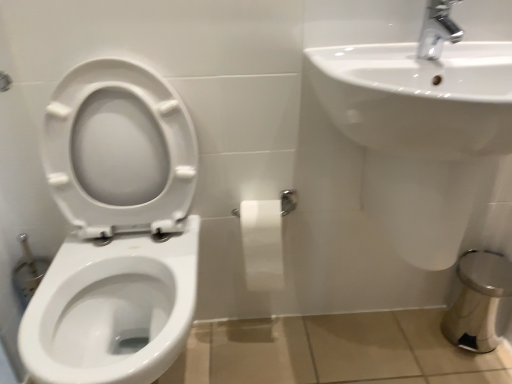
What do you see at coordinates (116, 229) in the screenshot? This screenshot has height=384, width=512. I see `white glossy toilet at left` at bounding box center [116, 229].

I want to click on white matte toilet paper at center, so click(x=262, y=244).

Is white glossy sink at upper right oriented towards chrome metallic faucet at upper right?

No, white glossy sink at upper right is not turned towards chrome metallic faucet at upper right.

Considering the relative sizes of white glossy sink at upper right and chrome metallic faucet at upper right in the image provided, is white glossy sink at upper right wider than chrome metallic faucet at upper right?

Yes, white glossy sink at upper right is wider than chrome metallic faucet at upper right.

Between white glossy sink at upper right and chrome metallic faucet at upper right, which one appears on the left side from the viewer's perspective?

white glossy sink at upper right.

Is white glossy sink at upper right not inside chrome metallic faucet at upper right?

white glossy sink at upper right lies outside chrome metallic faucet at upper right's area.

From the image's perspective, who appears lower, chrome metallic faucet at upper right or white matte toilet paper at center?

white matte toilet paper at center, from the image's perspective.

Which object is closer to the camera, chrome metallic faucet at upper right or white matte toilet paper at center?

chrome metallic faucet at upper right is more forward.

Can you confirm if chrome metallic faucet at upper right is smaller than white matte toilet paper at center?

Correct, chrome metallic faucet at upper right occupies less space than white matte toilet paper at center.

Are white matte toilet paper at center and white glossy toilet at left making contact?

No, white matte toilet paper at center is not in contact with white glossy toilet at left.

Image resolution: width=512 pixels, height=384 pixels. There is a white matte toilet paper at center. Identify the location of toilet above it (from a real-world perspective). (116, 229).

How distant is white matte toilet paper at center from white glossy toilet at left?

white matte toilet paper at center is 12.88 inches away from white glossy toilet at left.

Is white matte toilet paper at center bigger or smaller than white glossy toilet at left?

Clearly, white matte toilet paper at center is smaller in size than white glossy toilet at left.

Between chrome metallic faucet at upper right and white glossy toilet at left, which one appears on the right side from the viewer's perspective?

Positioned to the right is chrome metallic faucet at upper right.

Is chrome metallic faucet at upper right placed right next to white glossy toilet at left?

No.

This screenshot has height=384, width=512. What are the coordinates of `toilet below the chrome metallic faucet at upper right (from the image's perspective)` in the screenshot? It's located at (116, 229).

From the picture: Between white glossy toilet at left and white glossy sink at upper right, which one is positioned behind?

Positioned behind is white glossy sink at upper right.

Is point (150, 150) positioned in front of point (455, 131)?

No, (150, 150) is behind (455, 131).

Based on their positions, is white glossy toilet at left located to the left or right of white glossy sink at upper right?

In the image, white glossy toilet at left appears on the left side of white glossy sink at upper right.

Is white glossy toilet at left oriented towards white glossy sink at upper right?

No, white glossy toilet at left is not aimed at white glossy sink at upper right.

Which object is positioned more to the left, chrome metallic faucet at upper right or white glossy sink at upper right?

Positioned to the left is white glossy sink at upper right.

Is chrome metallic faucet at upper right oriented towards white glossy sink at upper right?

No, chrome metallic faucet at upper right is not turned towards white glossy sink at upper right.

Between chrome metallic faucet at upper right and white glossy sink at upper right, which one has less height?

Standing shorter between the two is chrome metallic faucet at upper right.

Would you consider chrome metallic faucet at upper right to be distant from white glossy sink at upper right?

No, chrome metallic faucet at upper right is not far away from white glossy sink at upper right.

Does white glossy sink at upper right appear on the right side of white matte toilet paper at center?

Indeed, white glossy sink at upper right is positioned on the right side of white matte toilet paper at center.

Looking at this image, considering the relative sizes of white glossy sink at upper right and white matte toilet paper at center in the image provided, is white glossy sink at upper right shorter than white matte toilet paper at center?

No, white glossy sink at upper right is not shorter than white matte toilet paper at center.

From a real-world perspective, relative to white matte toilet paper at center, is white glossy sink at upper right vertically above or below?

white glossy sink at upper right is situated higher than white matte toilet paper at center in the real world.

Image resolution: width=512 pixels, height=384 pixels. Find the location of `sink to the left of chrome metallic faucet at upper right`. sink to the left of chrome metallic faucet at upper right is located at coordinates (419, 133).

Locate an element on the screen. The image size is (512, 384). tap lying in front of the white matte toilet paper at center is located at coordinates (437, 29).

In the scene shown: When comparing their distances from white glossy toilet at left, does chrome metallic faucet at upper right or white matte toilet paper at center seem further?

The object further to white glossy toilet at left is chrome metallic faucet at upper right.

Based on their spatial positions, is chrome metallic faucet at upper right or white glossy sink at upper right closer to white matte toilet paper at center?

white glossy sink at upper right is closer to white matte toilet paper at center.

Which object lies nearer to the anchor point white glossy toilet at left, white matte toilet paper at center or chrome metallic faucet at upper right?

white matte toilet paper at center.

Considering their positions, is white matte toilet paper at center positioned further to chrome metallic faucet at upper right than white glossy toilet at left?

The object further to chrome metallic faucet at upper right is white glossy toilet at left.

Estimate the real-world distances between objects in this image. Which object is further from chrome metallic faucet at upper right, white matte toilet paper at center or white glossy sink at upper right?

white matte toilet paper at center is positioned further to the anchor chrome metallic faucet at upper right.

Looking at the image, which one is located further to white glossy sink at upper right, white glossy toilet at left or chrome metallic faucet at upper right?

Based on the image, white glossy toilet at left appears to be further to white glossy sink at upper right.

Looking at the image, which one is located further to white matte toilet paper at center, white glossy sink at upper right or white glossy toilet at left?

Based on the image, white glossy sink at upper right appears to be further to white matte toilet paper at center.

Based on their spatial positions, is white glossy sink at upper right or white matte toilet paper at center closer to white glossy toilet at left?

white matte toilet paper at center.

The width and height of the screenshot is (512, 384). Identify the location of toilet paper situated between white glossy toilet at left and chrome metallic faucet at upper right from left to right. (262, 244).

You are a GUI agent. You are given a task and a screenshot of the screen. Output one action in this format:
    pyautogui.click(x=<x>, y=<y>)
    Task: Click on the sink between chrome metallic faucet at upper right and white matte toilet paper at center vertically
    The width and height of the screenshot is (512, 384).
    Given the screenshot: What is the action you would take?
    (419, 133)

The image size is (512, 384). Find the location of `toilet paper between white glossy toilet at left and white glossy sink at upper right from left to right`. toilet paper between white glossy toilet at left and white glossy sink at upper right from left to right is located at coordinates (262, 244).

Image resolution: width=512 pixels, height=384 pixels. I want to click on sink situated between white glossy toilet at left and chrome metallic faucet at upper right from left to right, so click(419, 133).